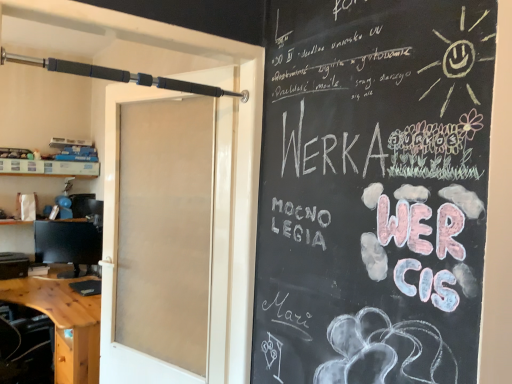
Question: Is wooden desk at lower left taller or shorter than white paper bag at left?

Choices:
 (A) short
 (B) tall

Answer: (B)

Question: Would you say wooden desk at lower left is to the left or to the right of white paper bag at left in the picture?

Choices:
 (A) left
 (B) right

Answer: (B)

Question: Estimate the real-world distances between objects in this image. Which object is farther from the white paper bag at left?

Choices:
 (A) white frosted glass door at center
 (B) black rubberized barbell at upper left
 (C) wooden desk at lower left
 (D) matte black monitor at left

Answer: (A)

Question: Which object is the closest to the white paper bag at left?

Choices:
 (A) black rubberized barbell at upper left
 (B) wooden desk at lower left
 (C) white frosted glass door at center
 (D) matte black monitor at left

Answer: (D)